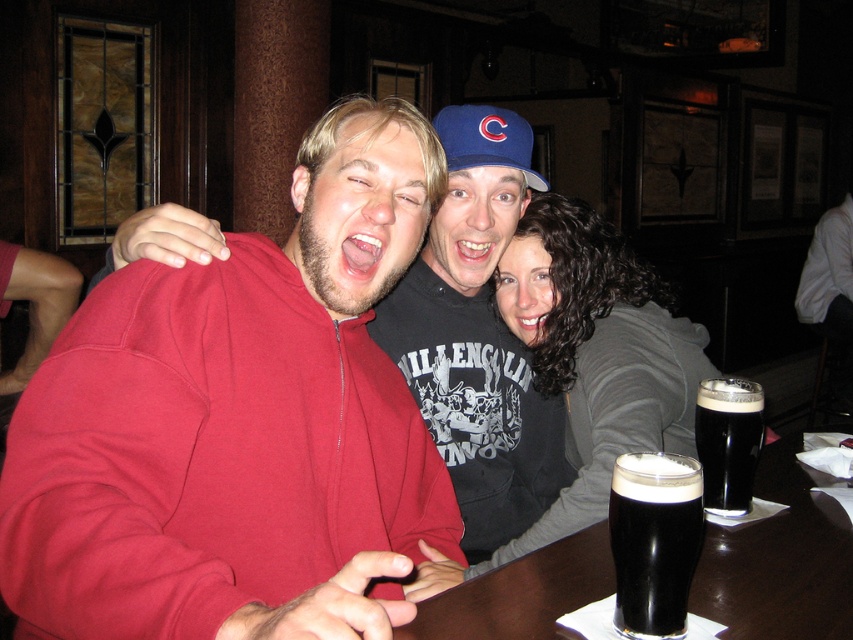
You are a bartender who needs to place a new drink order on the table. The drink will take up the same space as the black matte stout at center. Can you fit it on the dark wood table at center without moving anything else?

The dark wood table at center has a larger width than the black matte stout at center, so yes, the new drink can be placed on the dark wood table at center without moving anything else.